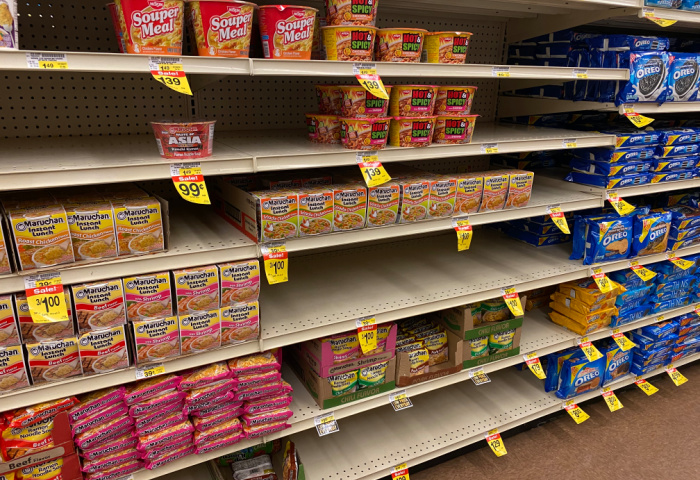
Locate an element on the screen. The width and height of the screenshot is (700, 480). store shelving is located at coordinates (425, 442), (302, 413), (307, 325), (342, 239), (337, 160), (316, 68), (659, 11), (624, 5).